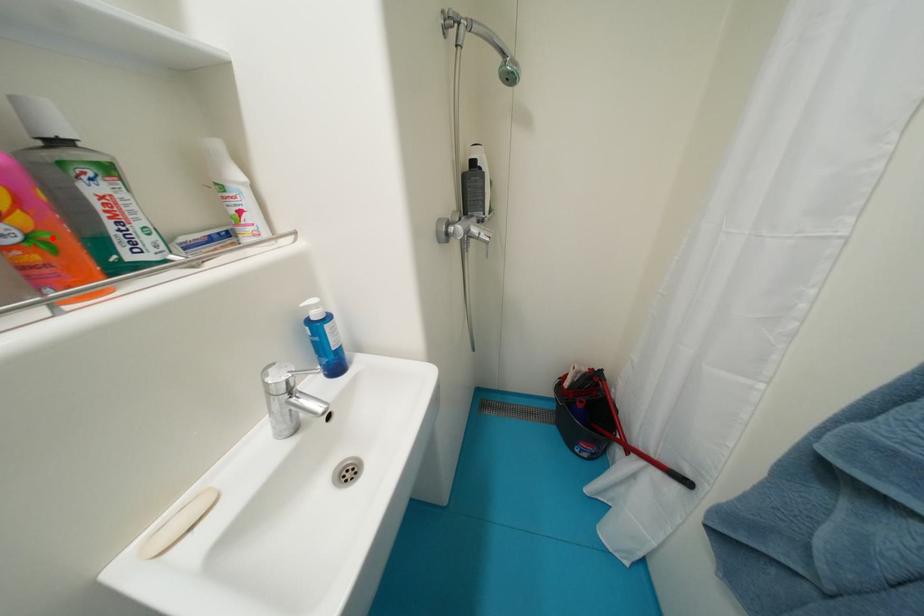
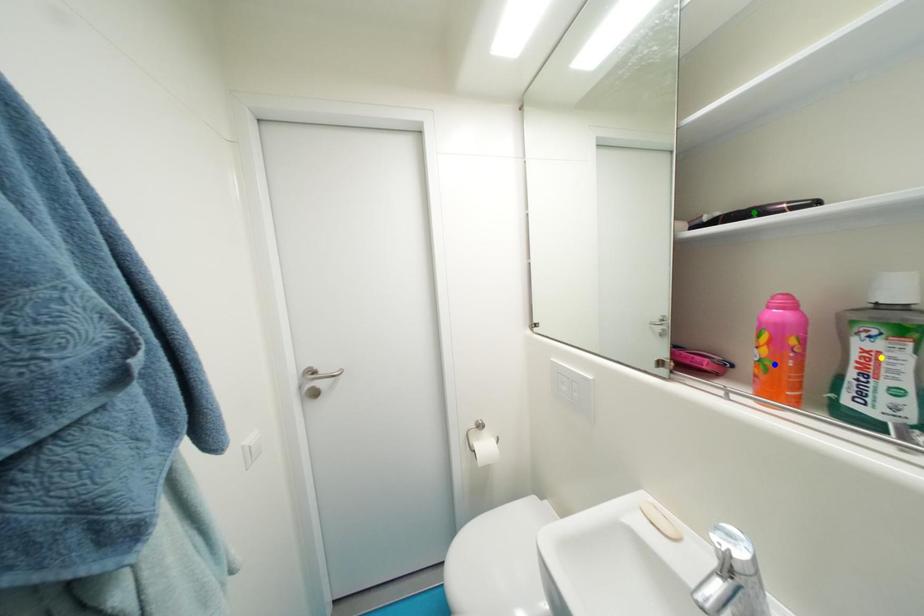
Question: I am providing you with two images of the same scene from different viewpoints. A red point is marked on the first image. You are given multiple points on the second image. In image 2, which mark is for the same physical point as the one in image 1?

Choices:
 (A) green point
 (B) yellow point
 (C) blue point

Answer: (C)